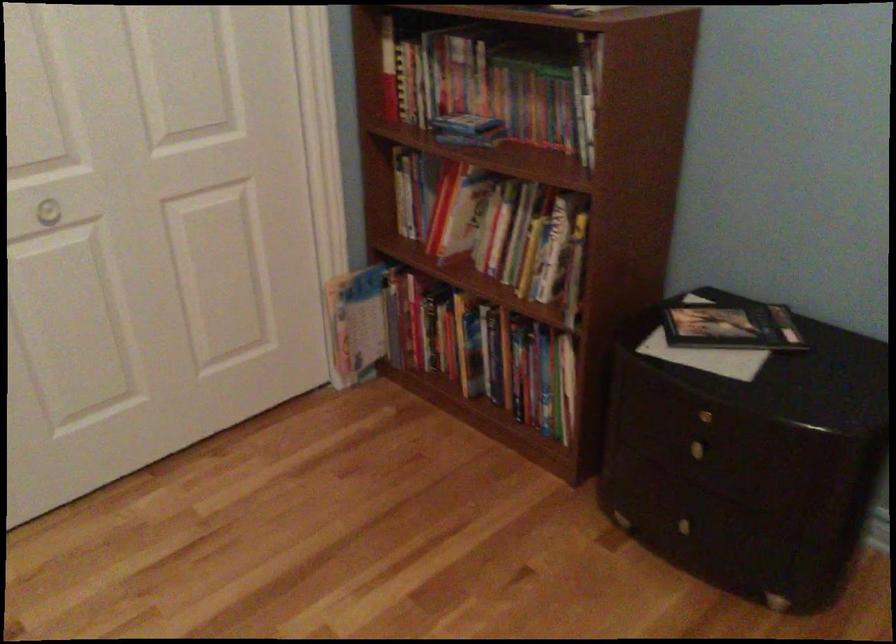
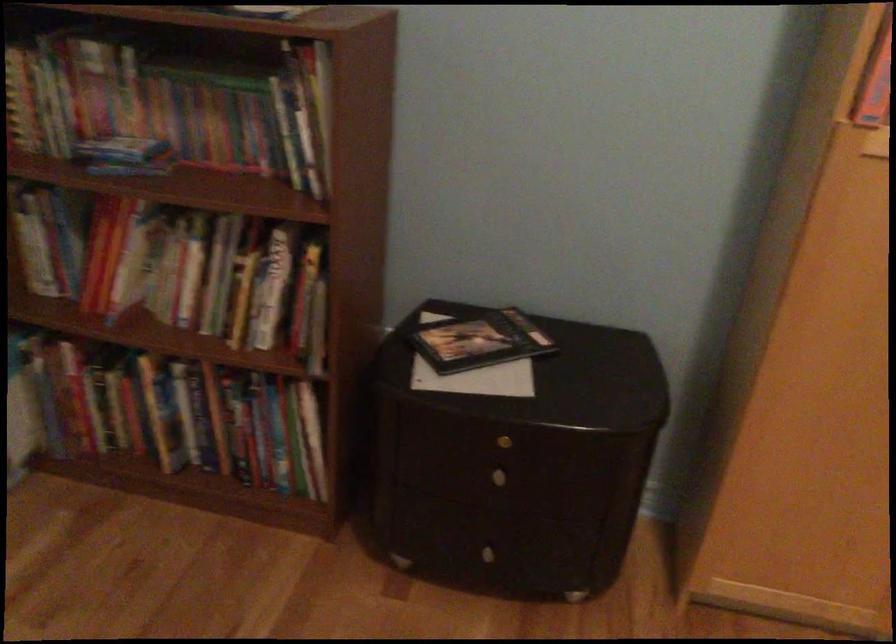
Question: Based on the continuous images, in which direction is the camera rotating? Reply with the corresponding letter.

Choices:
 (A) Left
 (B) Right
 (C) Up
 (D) Down

Answer: (B)